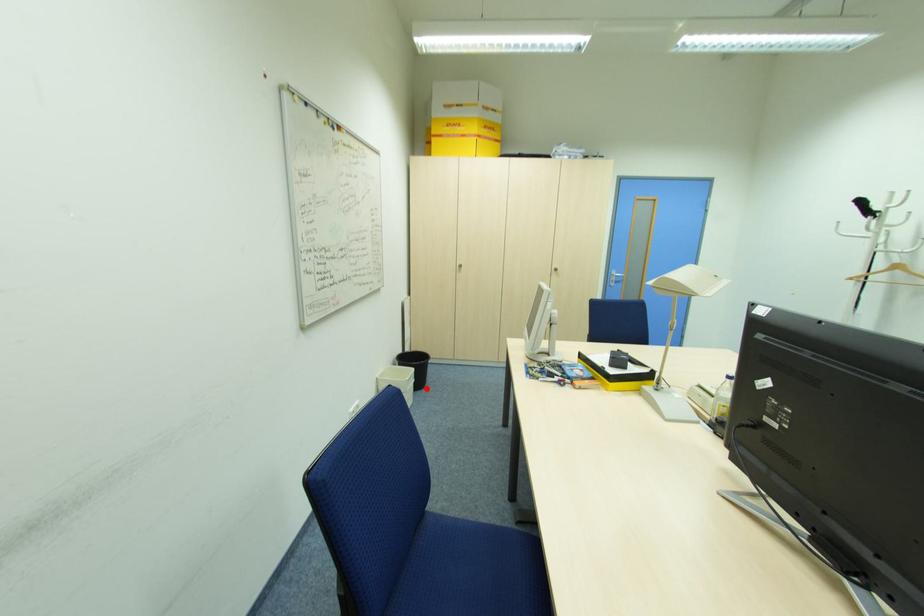
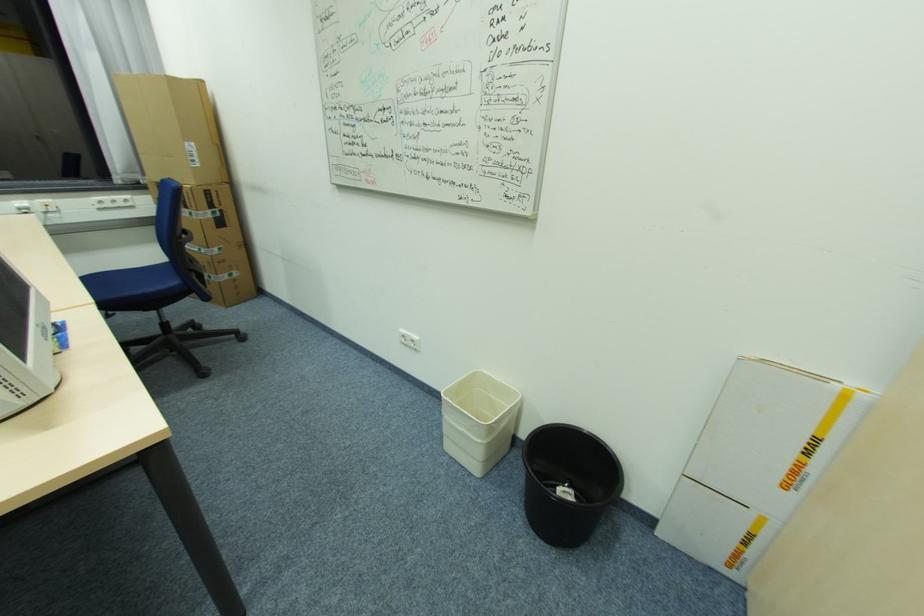
Where in the second image is the point corresponding to the highlighted location from the first image?

(533, 532)